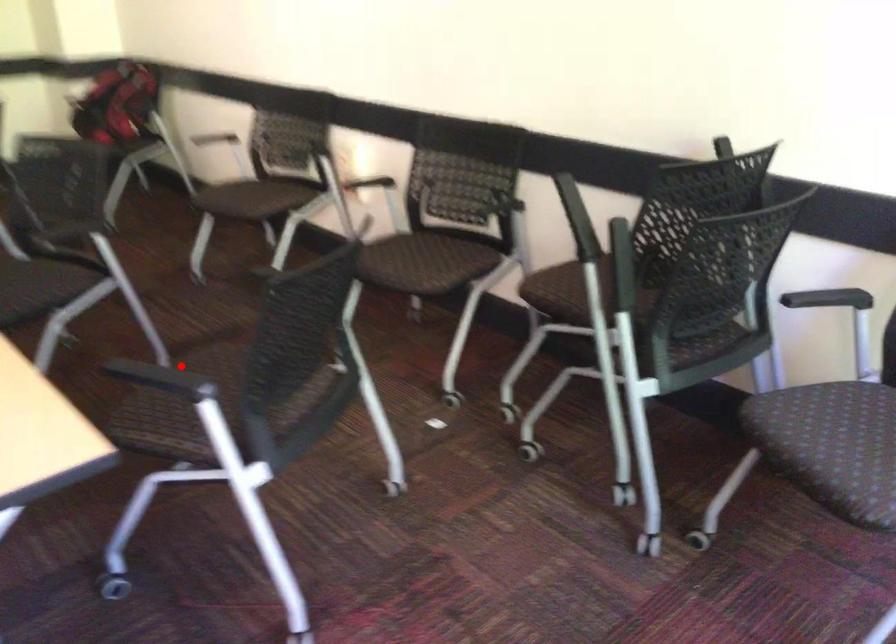
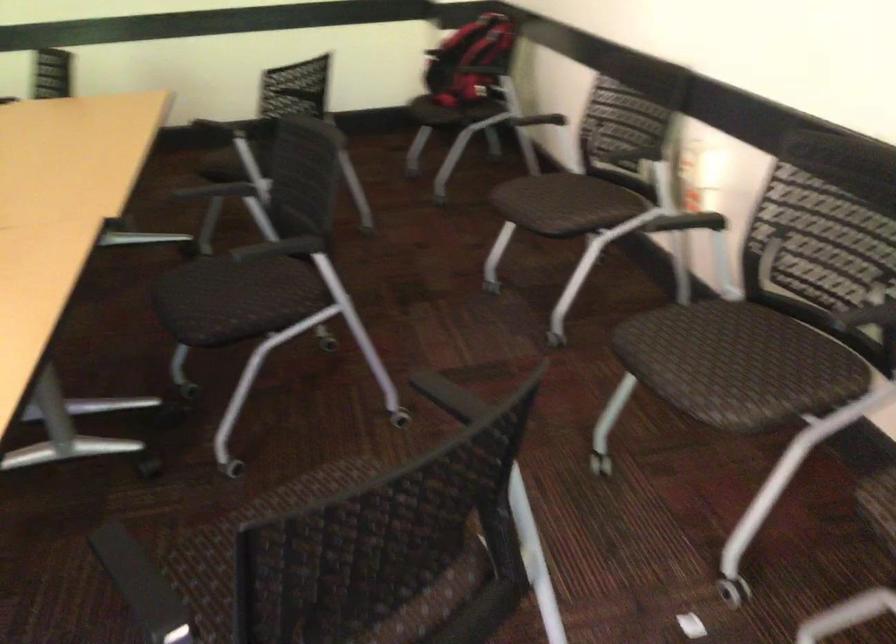
The point at the highlighted location is marked in the first image. Where is the corresponding point in the second image?

(313, 487)